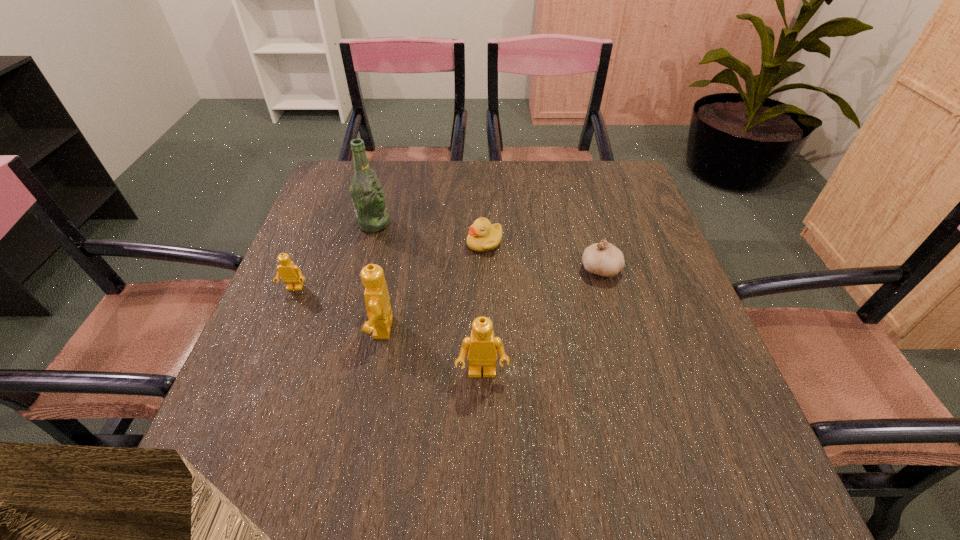
Locate an element on the screen. object that stands as the fourth closest to the tallest object is located at coordinates (481, 347).

Locate which object is the closest to the leftmost object. Please provide its 2D coordinates. Your answer should be formatted as a tuple, i.e. [(x, y)], where the tuple contains the x and y coordinates of a point satisfying the conditions above.

[(377, 300)]

Locate an element on the screen. Image resolution: width=960 pixels, height=540 pixels. the third closest Lego to the shortest object is located at coordinates (290, 273).

Identify which Lego is located as the nearest to the second object from left to right. Please provide its 2D coordinates. Your answer should be formatted as a tuple, i.e. [(x, y)], where the tuple contains the x and y coordinates of a point satisfying the conditions above.

[(290, 273)]

I want to click on vacant space that satisfies the following two spatial constraints: 1. on the surface of the tallest object; 2. on the face of the leftmost object, so click(356, 288).

Find the location of `vacant region that satisfies the following two spatial constraints: 1. on the surface of the fifth object from right to left; 2. on the face of the leftmost object`. vacant region that satisfies the following two spatial constraints: 1. on the surface of the fifth object from right to left; 2. on the face of the leftmost object is located at coordinates (356, 288).

Where is `vacant region that satisfies the following two spatial constraints: 1. on the surface of the beer bottle; 2. on the left side of the rightmost object`? This screenshot has height=540, width=960. vacant region that satisfies the following two spatial constraints: 1. on the surface of the beer bottle; 2. on the left side of the rightmost object is located at coordinates (362, 269).

You are a GUI agent. You are given a task and a screenshot of the screen. Output one action in this format:
    pyautogui.click(x=<x>, y=<y>)
    Task: Click on the free point that satisfies the following two spatial constraints: 1. on the beak of the duckling; 2. on the face of the nearest Lego
    
    Given the screenshot: What is the action you would take?
    pyautogui.click(x=486, y=374)